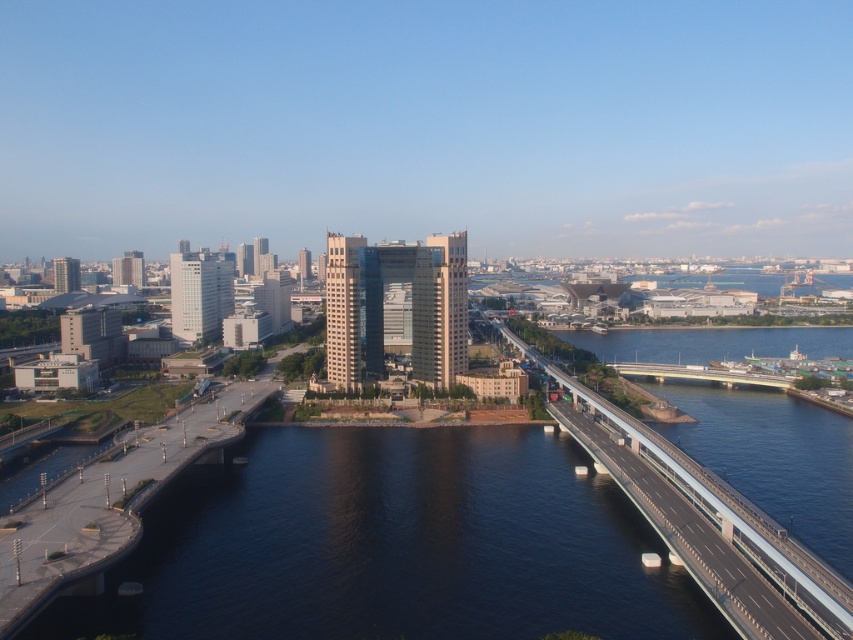
Question: Which of the following is the closest to the observer?

Choices:
 (A) (653, 522)
 (B) (720, 380)

Answer: (A)

Question: From the image, what is the correct spatial relationship of concrete bridge at right in relation to concrete bridge at center?

Choices:
 (A) right
 (B) left

Answer: (B)

Question: Does concrete bridge at right have a lesser width compared to concrete bridge at center?

Choices:
 (A) no
 (B) yes

Answer: (B)

Question: Is the position of concrete bridge at right less distant than that of concrete bridge at center?

Choices:
 (A) yes
 (B) no

Answer: (A)